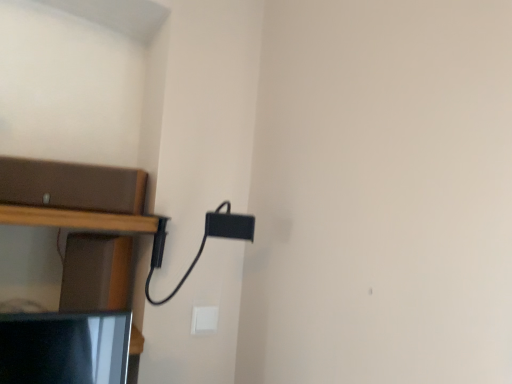
Question: From the image's perspective, is brown matte shelf at left located above or below white plastic light switch at lower center?

Choices:
 (A) below
 (B) above

Answer: (B)

Question: Does point (66, 195) appear closer or farther from the camera than point (216, 322)?

Choices:
 (A) closer
 (B) farther

Answer: (A)

Question: From a real-world perspective, relative to white plastic light switch at lower center, is brown matte shelf at left vertically above or below?

Choices:
 (A) below
 (B) above

Answer: (B)

Question: Does point (214, 306) appear closer or farther from the camera than point (88, 177)?

Choices:
 (A) farther
 (B) closer

Answer: (A)

Question: Is white plastic light switch at lower center wider or thinner than brown matte shelf at left?

Choices:
 (A) wide
 (B) thin

Answer: (B)

Question: Based on their sizes in the image, would you say white plastic light switch at lower center is bigger or smaller than brown matte shelf at left?

Choices:
 (A) big
 (B) small

Answer: (B)

Question: In the image, is white plastic light switch at lower center on the left side or the right side of brown matte shelf at left?

Choices:
 (A) right
 (B) left

Answer: (A)